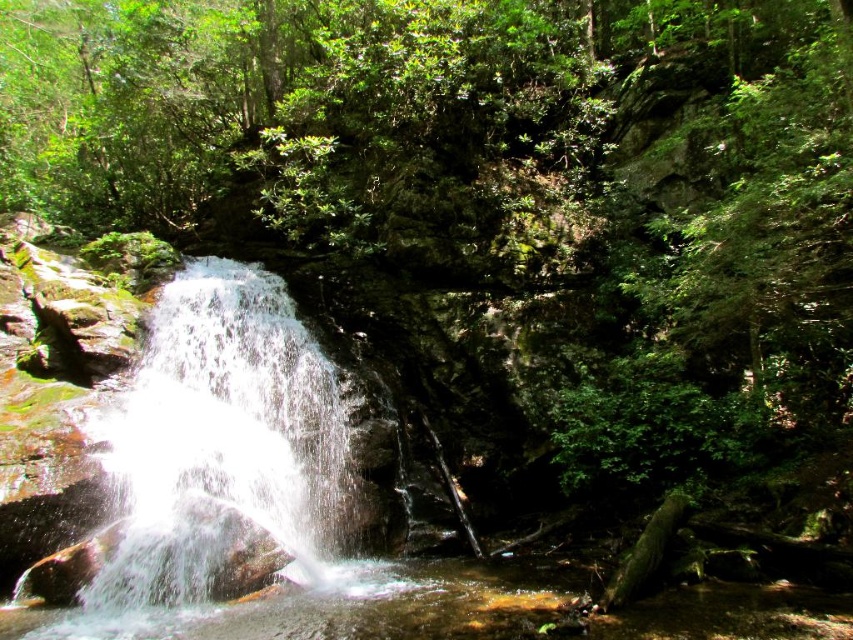
Question: Which object is farther from the camera taking this photo?

Choices:
 (A) white frothy water at center
 (B) clear water at center

Answer: (A)

Question: Does white frothy water at center appear under clear water at center?

Choices:
 (A) yes
 (B) no

Answer: (B)

Question: Can you confirm if white frothy water at center is positioned to the right of clear water at center?

Choices:
 (A) yes
 (B) no

Answer: (B)

Question: Which point is closer to the camera taking this photo?

Choices:
 (A) (215, 324)
 (B) (473, 628)

Answer: (B)

Question: Is white frothy water at center smaller than clear water at center?

Choices:
 (A) yes
 (B) no

Answer: (B)